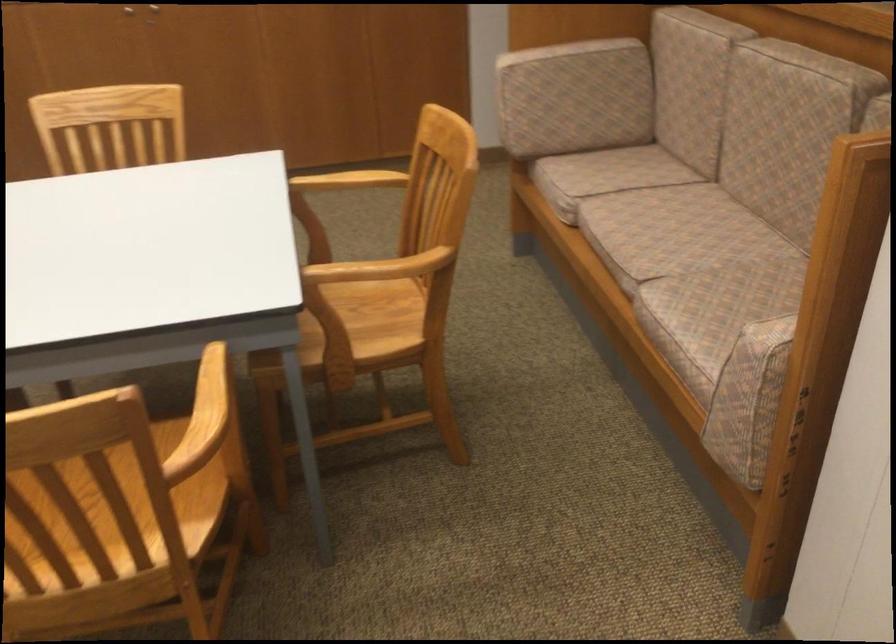
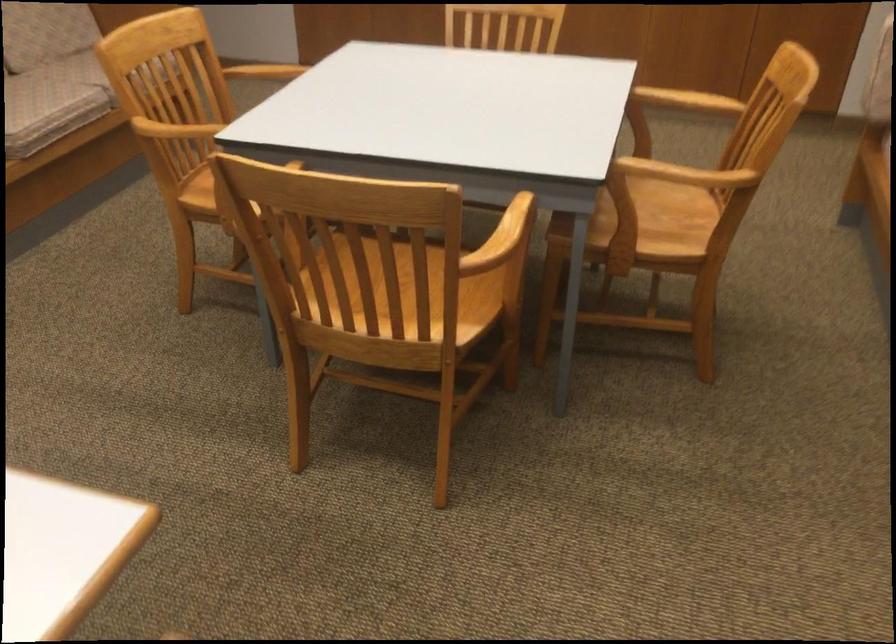
Which direction would the cameraman need to move to produce the second image?

The cameraman walked toward right, backward.